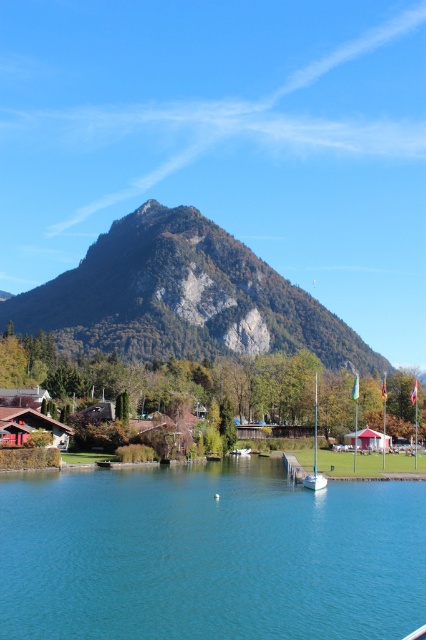
You are planning to sail a small boat from the shore to the middle of the lake. The white glossy sailboat at center is currently docked at the shore. Based on the scene, can you estimate whether the teal water at center is wide enough for the sailboat to navigate through?

The teal water at center is wider than the white glossy sailboat at center, so the sailboat can navigate through the teal water at center without any issues.

You are standing at the shore of the lake and want to locate the teal water at center. According to the coordinates provided, in which direction should you look to find it?

You should look directly ahead since the teal water at center is located at the coordinates point (209, 554), which is straight ahead from your position at the shore.